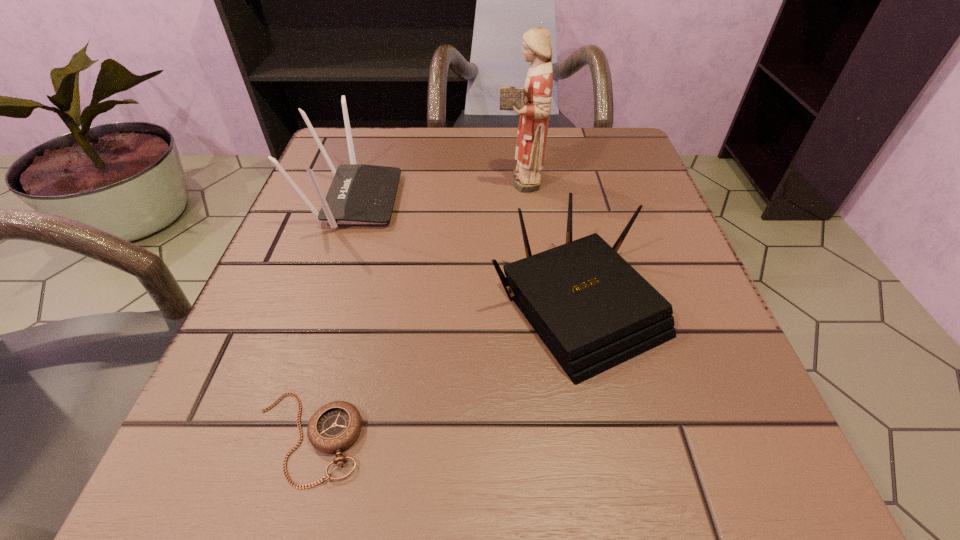
The height and width of the screenshot is (540, 960). Find the location of `vacant region between the second shortest object and the nearest object`. vacant region between the second shortest object and the nearest object is located at coordinates (443, 372).

Find the location of a particular element. vacant region between the third shortest object and the nearer router is located at coordinates (465, 253).

At what (x,y) coordinates should I click in order to perform the action: click on empty space that is in between the tallest object and the farther router. Please return your answer as a coordinate pair (x, y). The height and width of the screenshot is (540, 960). Looking at the image, I should click on (436, 190).

Locate an element on the screen. The width and height of the screenshot is (960, 540). vacant space that's between the third shortest object and the third farthest object is located at coordinates (465, 253).

You are a GUI agent. You are given a task and a screenshot of the screen. Output one action in this format:
    pyautogui.click(x=<x>, y=<y>)
    Task: Click on the free area in between the figurine and the nearest object
    The height and width of the screenshot is (540, 960).
    Given the screenshot: What is the action you would take?
    pyautogui.click(x=413, y=309)

The width and height of the screenshot is (960, 540). I want to click on free point between the farther router and the third tallest object, so click(x=465, y=253).

Image resolution: width=960 pixels, height=540 pixels. In order to click on free space between the third tallest object and the shortest object in this screenshot , I will do `click(443, 372)`.

The image size is (960, 540). I want to click on free space between the right router and the tallest object, so click(x=548, y=243).

Select which object appears as the third closest to the farther router. Please provide its 2D coordinates. Your answer should be formatted as a tuple, i.e. [(x, y)], where the tuple contains the x and y coordinates of a point satisfying the conditions above.

[(335, 426)]

What are the coordinates of `object identified as the second closest to the right router` in the screenshot? It's located at (335, 426).